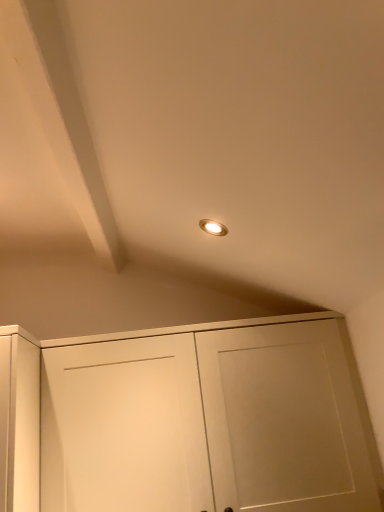
Question: Considering the relative sizes of white matte cabinet at center and matte white exhaust hood at upper left in the image provided, is white matte cabinet at center wider than matte white exhaust hood at upper left?

Choices:
 (A) no
 (B) yes

Answer: (A)

Question: Is white matte cabinet at center positioned before matte white exhaust hood at upper left?

Choices:
 (A) yes
 (B) no

Answer: (B)

Question: From a real-world perspective, is white matte cabinet at center positioned under matte white exhaust hood at upper left based on gravity?

Choices:
 (A) no
 (B) yes

Answer: (B)

Question: Is white matte cabinet at center turned away from matte white exhaust hood at upper left?

Choices:
 (A) yes
 (B) no

Answer: (B)

Question: Is white matte cabinet at center further to the viewer compared to matte white exhaust hood at upper left?

Choices:
 (A) yes
 (B) no

Answer: (A)

Question: Considering the relative sizes of white matte cabinet at center and matte white exhaust hood at upper left in the image provided, is white matte cabinet at center taller than matte white exhaust hood at upper left?

Choices:
 (A) no
 (B) yes

Answer: (B)

Question: Does matte white exhaust hood at upper left contain white matte cabinet at center?

Choices:
 (A) no
 (B) yes

Answer: (A)

Question: Is matte white exhaust hood at upper left oriented towards white matte cabinet at center?

Choices:
 (A) yes
 (B) no

Answer: (B)

Question: Is matte white exhaust hood at upper left completely or partially outside of white matte cabinet at center?

Choices:
 (A) no
 (B) yes

Answer: (B)

Question: Does matte white exhaust hood at upper left have a greater width compared to white matte cabinet at center?

Choices:
 (A) yes
 (B) no

Answer: (A)

Question: From the image's perspective, does matte white exhaust hood at upper left appear higher than white matte cabinet at center?

Choices:
 (A) no
 (B) yes

Answer: (B)

Question: Does matte white exhaust hood at upper left appear on the right side of white matte cabinet at center?

Choices:
 (A) yes
 (B) no

Answer: (B)

Question: Would you say white matte cabinet at center is to the left or to the right of matte white exhaust hood at upper left in the picture?

Choices:
 (A) right
 (B) left

Answer: (A)